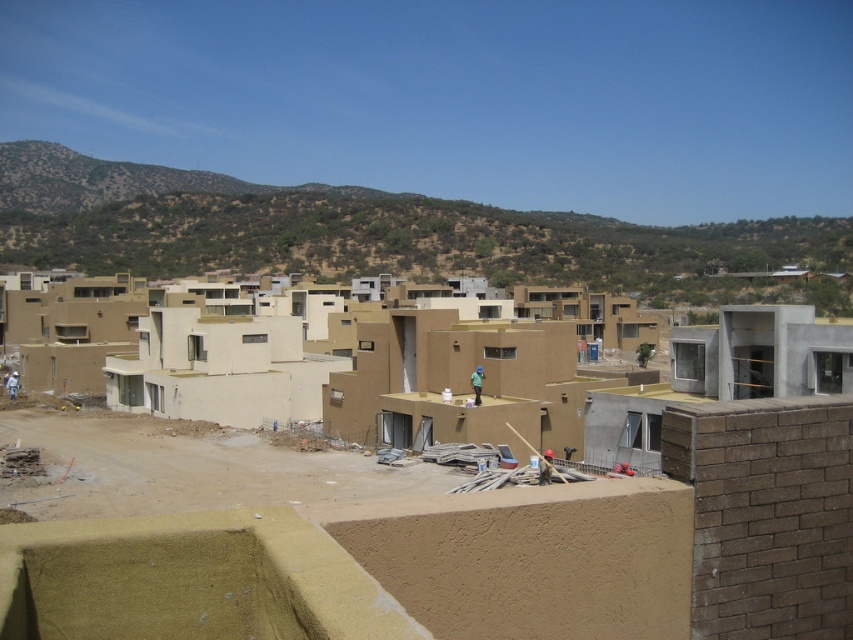
Question: Which point appears closest to the camera in this image?

Choices:
 (A) (41, 228)
 (B) (476, 369)
 (C) (79, 600)

Answer: (C)

Question: Among these points, which one is farthest from the camera?

Choices:
 (A) (691, 241)
 (B) (289, 540)
 (C) (479, 376)

Answer: (A)

Question: Is brown textured hillside at upper center wider than green matte construction worker at center?

Choices:
 (A) yes
 (B) no

Answer: (A)

Question: Is matte beige building at center behind brown textured hillside at upper center?

Choices:
 (A) no
 (B) yes

Answer: (A)

Question: Which point is farther to the camera?

Choices:
 (A) (817, 515)
 (B) (473, 378)

Answer: (B)

Question: Is the position of brown textured hillside at upper center more distant than that of green matte construction worker at center?

Choices:
 (A) yes
 (B) no

Answer: (A)